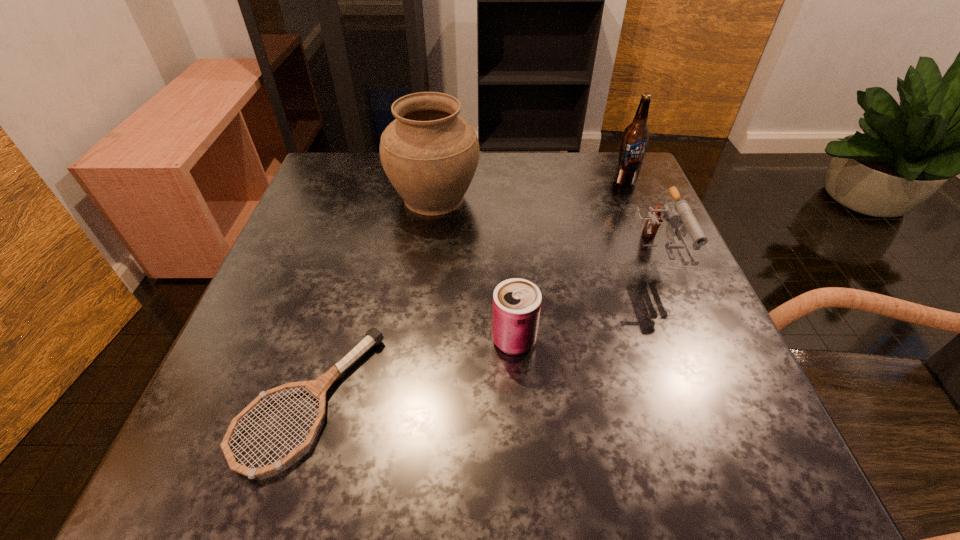
In the image, there is a desktop. Where is `vacant space at the far edge`? Image resolution: width=960 pixels, height=540 pixels. vacant space at the far edge is located at coordinates (528, 186).

At what (x,y) coordinates should I click in order to perform the action: click on free space at the near edge of the desktop. Please return your answer as a coordinate pair (x, y). Looking at the image, I should click on (439, 476).

Where is `vacant space at the left edge of the desktop`? The image size is (960, 540). vacant space at the left edge of the desktop is located at coordinates (334, 288).

The image size is (960, 540). Identify the location of free space at the right edge of the desktop. (633, 228).

Where is `vacant space at the far left corner`? This screenshot has height=540, width=960. vacant space at the far left corner is located at coordinates (365, 201).

Where is `vacant space at the near left corner of the desktop`? This screenshot has height=540, width=960. vacant space at the near left corner of the desktop is located at coordinates (219, 465).

Locate an element on the screen. The width and height of the screenshot is (960, 540). vacant area between the shortest object and the third shortest object is located at coordinates (481, 330).

Locate an element on the screen. This screenshot has width=960, height=540. free spot between the third shortest object and the urn is located at coordinates (543, 229).

This screenshot has height=540, width=960. I want to click on free space between the urn and the third farthest object, so click(543, 229).

Find the location of a particular element. This screenshot has width=960, height=540. free point between the third farthest object and the urn is located at coordinates (543, 229).